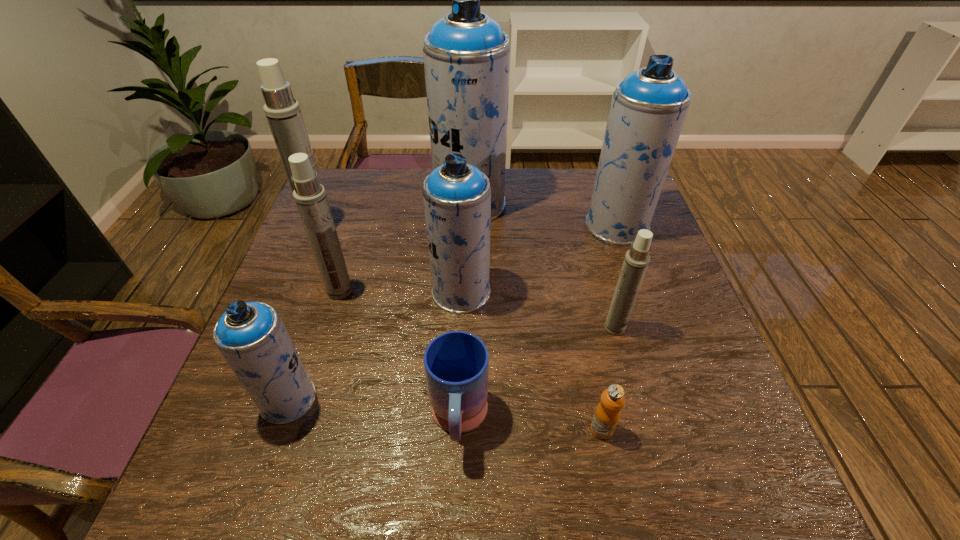
The width and height of the screenshot is (960, 540). In the image, there is a desktop. Find the location of `vacant region at the far right corner`. vacant region at the far right corner is located at coordinates (584, 172).

Find the location of a particular element. unoccupied position between the biggest white aerosol can and the mug is located at coordinates (390, 325).

The height and width of the screenshot is (540, 960). Identify the location of vacant space that is in between the leftmost white aerosol can and the second nearest blue aerosol can. (391, 261).

Locate an element on the screen. Image resolution: width=960 pixels, height=540 pixels. blank region between the tallest aerosol can and the second biggest blue aerosol can is located at coordinates (543, 215).

Find the location of a particular element. vacant space that's between the smallest blue aerosol can and the eighth tallest object is located at coordinates (373, 410).

You are a GUI agent. You are given a task and a screenshot of the screen. Output one action in this format:
    pyautogui.click(x=<x>, y=<y>)
    Task: Click on the vacant area that lies between the second nearest aerosol can and the orange juice
    The width and height of the screenshot is (960, 540).
    Given the screenshot: What is the action you would take?
    pyautogui.click(x=608, y=379)

Locate an element on the screen. This screenshot has width=960, height=540. vacant area between the biggest blue aerosol can and the sixth farthest aerosol can is located at coordinates (542, 266).

You are a GUI agent. You are given a task and a screenshot of the screen. Output one action in this format:
    pyautogui.click(x=<x>, y=<y>)
    Task: Click on the free point between the smallest white aerosol can and the tallest object
    
    Given the screenshot: What is the action you would take?
    pyautogui.click(x=542, y=266)

Identify which object is located as the fourth nearest to the rightmost blue aerosol can. Please provide its 2D coordinates. Your answer should be formatted as a tuple, i.e. [(x, y)], where the tuple contains the x and y coordinates of a point satisfying the conditions above.

[(607, 414)]

Identify which object is the fifth nearest to the farthest white aerosol can. Please provide its 2D coordinates. Your answer should be formatted as a tuple, i.e. [(x, y)], where the tuple contains the x and y coordinates of a point satisfying the conditions above.

[(456, 363)]